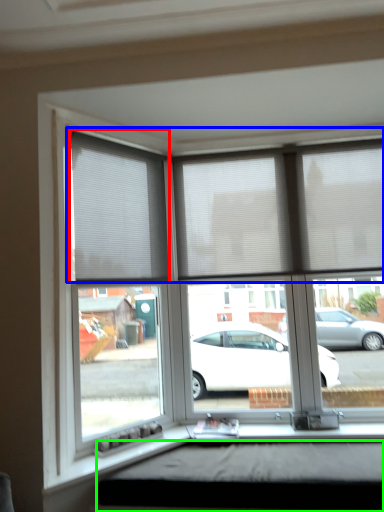
Question: Which object is the closest to the window blind (highlighted by a red box)? Choose among these: blind (highlighted by a blue box) or window box (highlighted by a green box).

Choices:
 (A) blind
 (B) window box

Answer: (A)